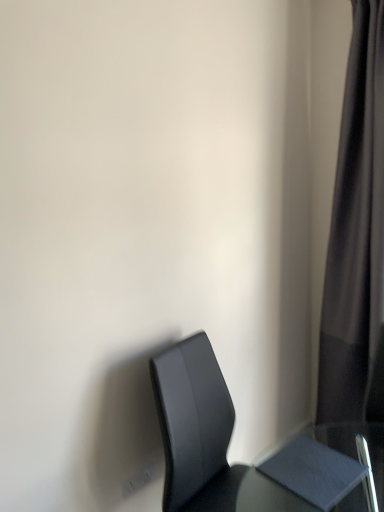
Question: Is matte gray table at lower right outside of matte black chair at lower right?

Choices:
 (A) yes
 (B) no

Answer: (B)

Question: From the image's perspective, is matte gray table at lower right over matte black chair at lower right?

Choices:
 (A) no
 (B) yes

Answer: (B)

Question: Is matte gray table at lower right aimed at matte black chair at lower right?

Choices:
 (A) yes
 (B) no

Answer: (A)

Question: Is matte gray table at lower right at the left side of matte black chair at lower right?

Choices:
 (A) no
 (B) yes

Answer: (A)

Question: From a real-world perspective, does matte gray table at lower right stand above matte black chair at lower right?

Choices:
 (A) no
 (B) yes

Answer: (B)

Question: Is matte black chair at lower right surrounded by matte gray table at lower right?

Choices:
 (A) yes
 (B) no

Answer: (B)

Question: Considering the relative sizes of black fabric curtain at right and matte gray table at lower right in the image provided, is black fabric curtain at right thinner than matte gray table at lower right?

Choices:
 (A) yes
 (B) no

Answer: (B)

Question: Can you confirm if black fabric curtain at right is wider than matte gray table at lower right?

Choices:
 (A) no
 (B) yes

Answer: (B)

Question: Is matte gray table at lower right surrounded by black fabric curtain at right?

Choices:
 (A) no
 (B) yes

Answer: (A)

Question: From the image's perspective, is black fabric curtain at right below matte gray table at lower right?

Choices:
 (A) yes
 (B) no

Answer: (B)

Question: Can you confirm if black fabric curtain at right is smaller than matte gray table at lower right?

Choices:
 (A) no
 (B) yes

Answer: (A)

Question: Is the depth of black fabric curtain at right less than that of matte gray table at lower right?

Choices:
 (A) yes
 (B) no

Answer: (B)

Question: Can you confirm if matte black chair at lower right is bigger than black fabric curtain at right?

Choices:
 (A) yes
 (B) no

Answer: (B)